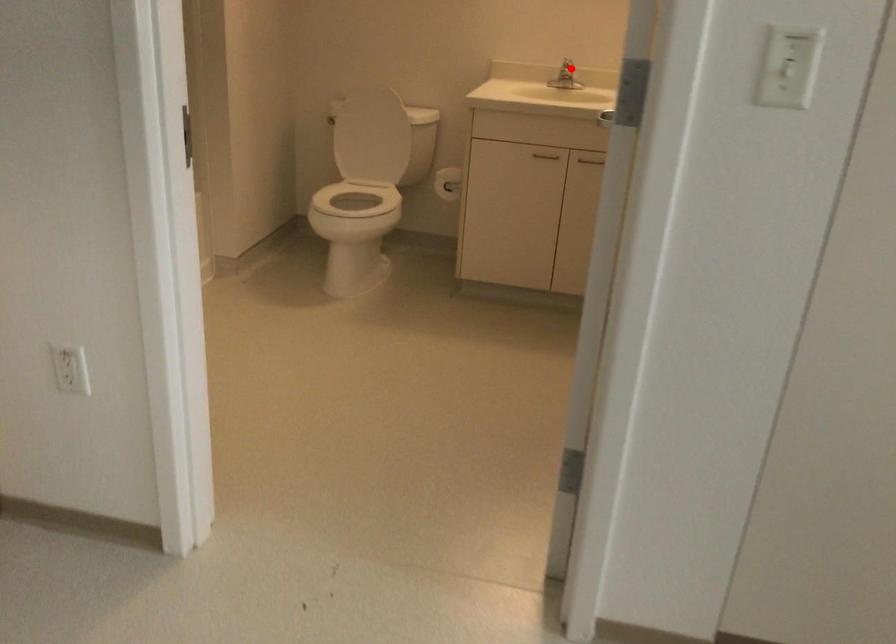
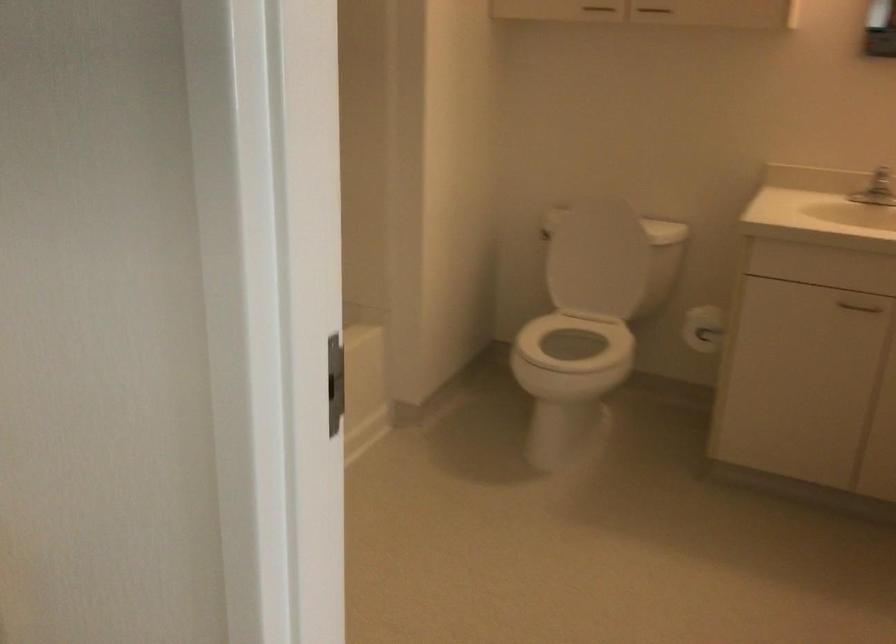
The point at the highlighted location is marked in the first image. Where is the corresponding point in the second image?

(881, 182)